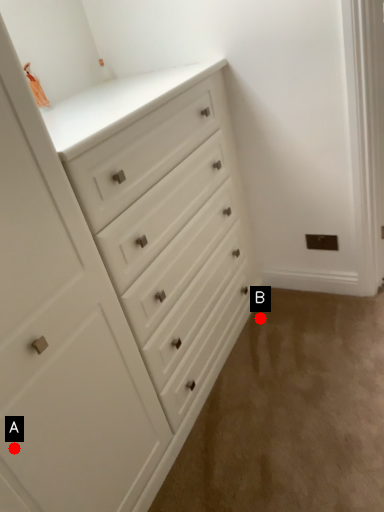
Question: Two points are circled on the image, labeled by A and B beside each circle. Which point is further to the camera?

Choices:
 (A) A is further
 (B) B is further

Answer: (B)